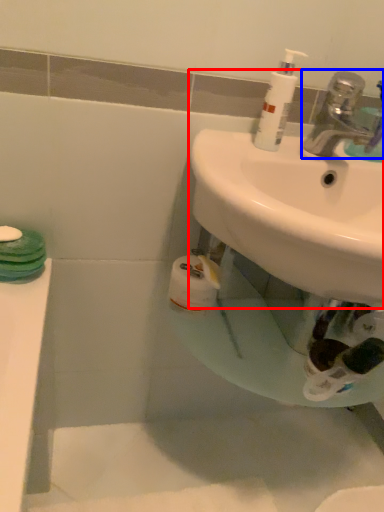
Question: Which object appears farthest to the camera in this image, sink (highlighted by a red box) or tap (highlighted by a blue box)?

Choices:
 (A) sink
 (B) tap

Answer: (B)